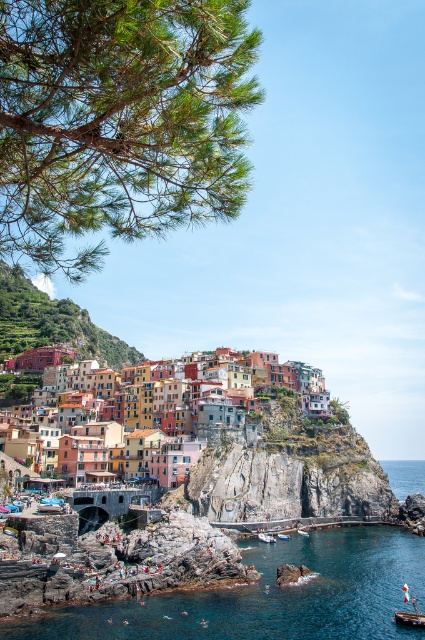
Is multicolored stone village at center above wooden boat at lower center?

Correct, multicolored stone village at center is located above wooden boat at lower center.

Between multicolored stone village at center and wooden boat at lower center, which one is positioned higher?

Positioned higher is multicolored stone village at center.

Between point (329, 406) and point (280, 536), which one is positioned in front?

Point (280, 536) is in front.

Identify the location of multicolored stone village at center. This screenshot has width=425, height=640. (274, 380).

The image size is (425, 640). What do you see at coordinates (268, 596) in the screenshot?
I see `clear blue water at lower center` at bounding box center [268, 596].

Does clear blue water at lower center appear on the right side of white plastic boat at lower center?

Yes, clear blue water at lower center is to the right of white plastic boat at lower center.

Does point (110, 600) come closer to viewer compared to point (274, 541)?

Yes, it is in front of point (274, 541).

Locate an element on the screen. Image resolution: width=425 pixels, height=640 pixels. clear blue water at lower center is located at coordinates (268, 596).

Does multicolored stone village at center lie in front of white plastic boat at lower center?

No, multicolored stone village at center is behind white plastic boat at lower center.

Who is lower down, multicolored stone village at center or white plastic boat at lower center?

white plastic boat at lower center is below.

Locate an element on the screen. multicolored stone village at center is located at coordinates (274, 380).